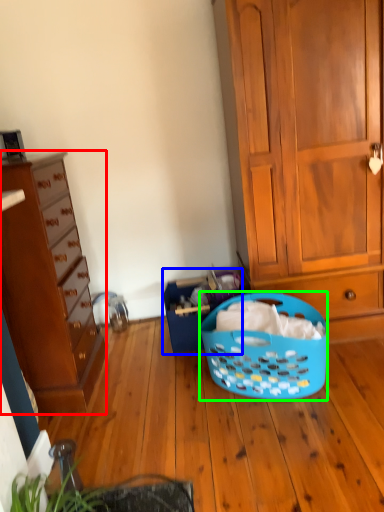
Question: Which is farther away from cabinetry (highlighted by a red box)? shopping basket (highlighted by a blue box) or picnic basket (highlighted by a green box)?

Choices:
 (A) shopping basket
 (B) picnic basket

Answer: (B)